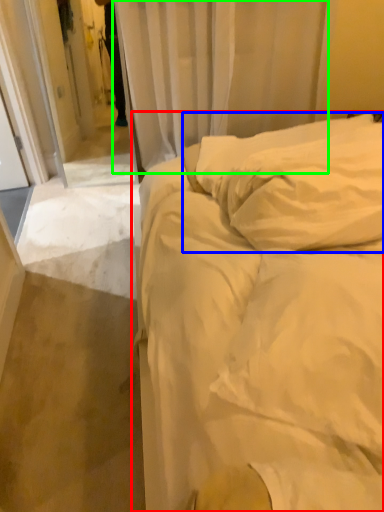
Question: Estimate the real-world distances between objects in this image. Which object is closer to bed (highlighted by a red box), pillow (highlighted by a blue box) or curtain (highlighted by a green box)?

Choices:
 (A) pillow
 (B) curtain

Answer: (A)